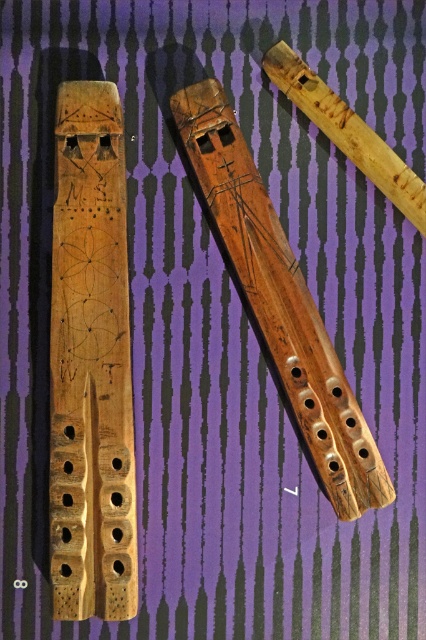
Question: Does natural wood flute at left have a larger size compared to natural wood flute at center?

Choices:
 (A) no
 (B) yes

Answer: (A)

Question: Which point is farther to the camera?

Choices:
 (A) (275, 220)
 (B) (123, 161)

Answer: (A)

Question: Is natural wood flute at left above natural wood flute at center?

Choices:
 (A) yes
 (B) no

Answer: (B)

Question: Among these objects, which one is farthest from the camera?

Choices:
 (A) natural wood flute at left
 (B) natural wood flute at center

Answer: (B)

Question: Is the position of natural wood flute at left less distant than that of natural wood flute at center?

Choices:
 (A) yes
 (B) no

Answer: (A)